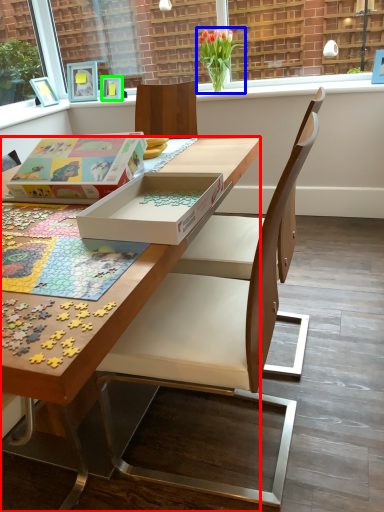
Question: Which is farther away from desk (highlighted by a red box)? flower (highlighted by a blue box) or picture frame (highlighted by a green box)?

Choices:
 (A) flower
 (B) picture frame

Answer: (B)